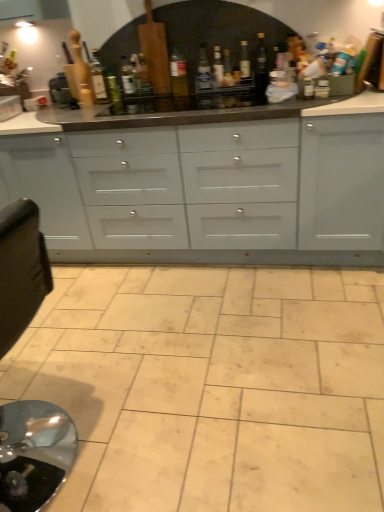
Locate an element on the screen. The height and width of the screenshot is (512, 384). vacant space in front of wooden rolling pin at upper left, which is counted as the 1th bottle, starting from the left is located at coordinates (90, 112).